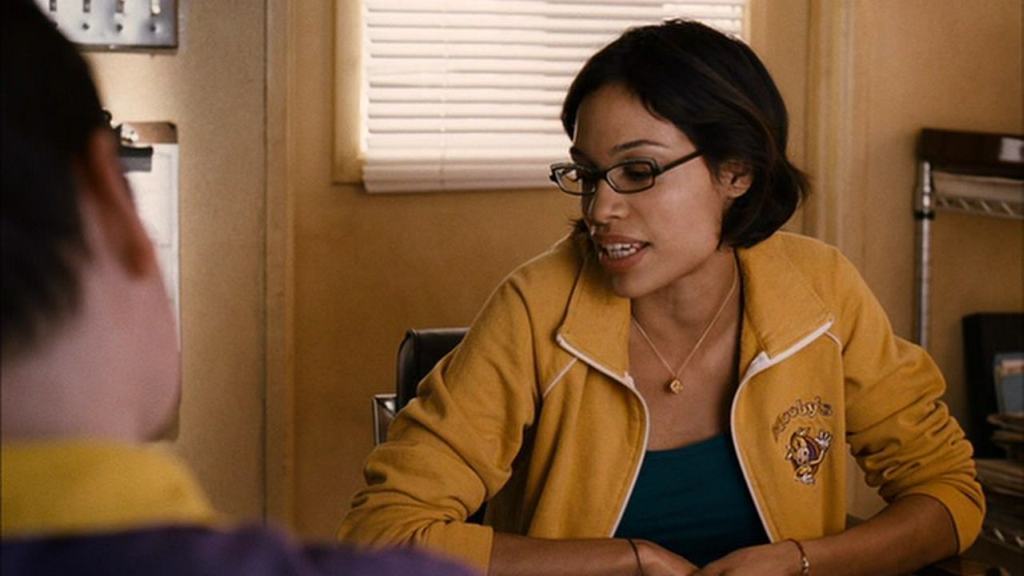
Image resolution: width=1024 pixels, height=576 pixels. I want to click on chair, so click(x=422, y=356).